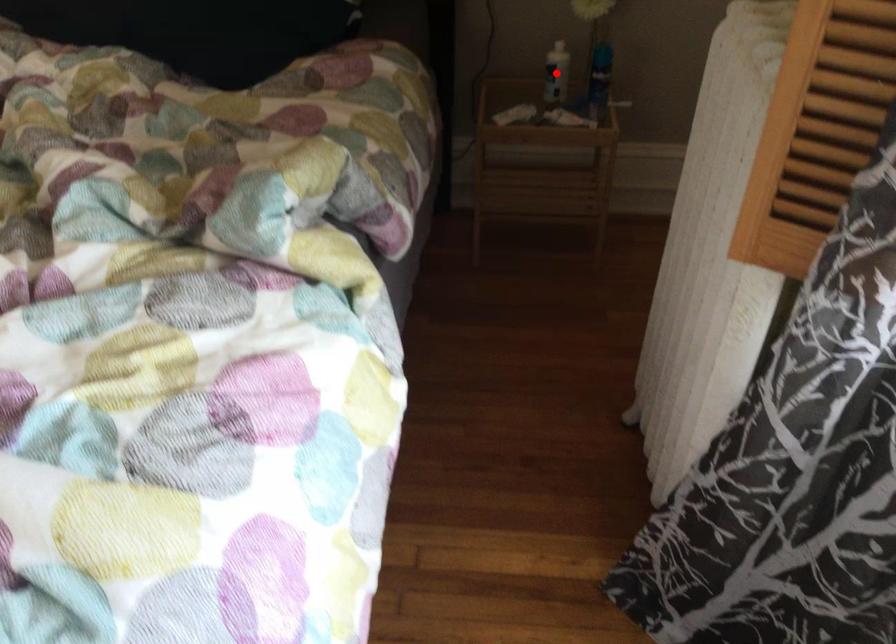
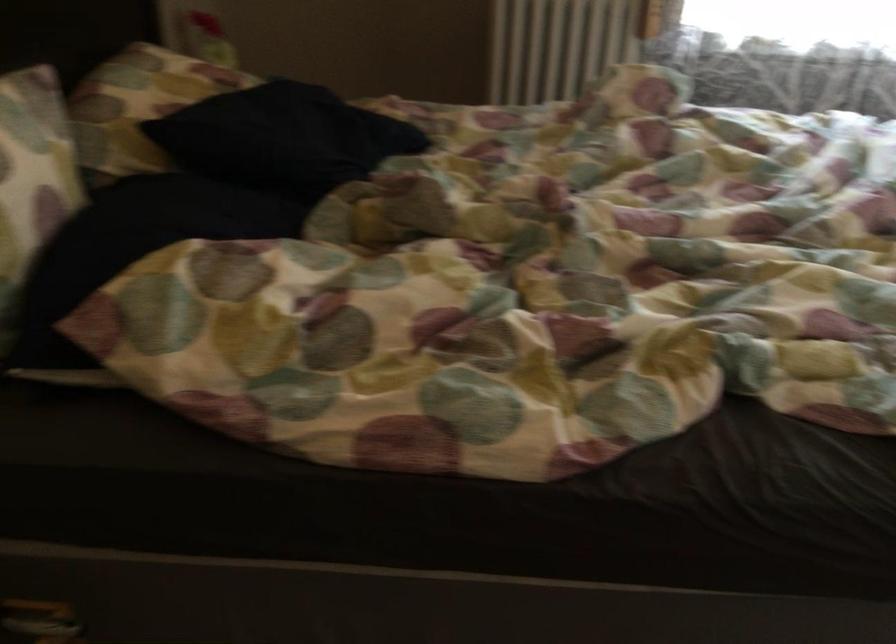
Question: I am providing you with two images of the same scene from different viewpoints. A red point is marked on the first image. At the location where the point appears in image 1, is it still visible in image 2?

Choices:
 (A) Yes
 (B) No

Answer: (B)